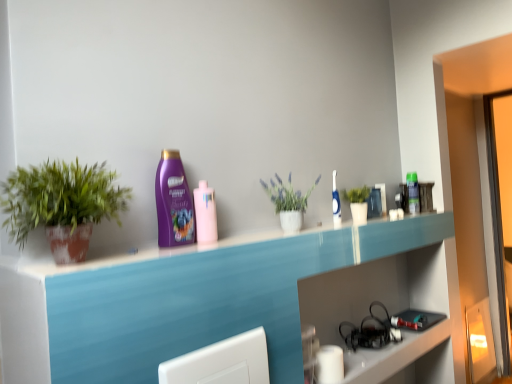
Question: In the image, is white matte vase at center, the second houseplant viewed from the left, positioned in front of or behind green matte plant at left, arranged as the 3th houseplant when viewed from the right?

Choices:
 (A) front
 (B) behind

Answer: (B)

Question: Considering the positions of white matte vase at center, positioned as the 2th houseplant in right-to-left order, and green matte plant at left, arranged as the 3th houseplant when viewed from the right, in the image, is white matte vase at center, positioned as the 2th houseplant in right-to-left order, wider or thinner than green matte plant at left, arranged as the 3th houseplant when viewed from the right,?

Choices:
 (A) thin
 (B) wide

Answer: (A)

Question: Based on their relative distances, which object is farther from the green matte plant at upper right, marked as the 3th houseplant in a front-to-back arrangement?

Choices:
 (A) green matte plant at left, acting as the first houseplant starting from the front
 (B) white matte vase at center, the 2th houseplant viewed from the front
 (C) pink glossy mouthwash at center, positioned as the first mouthwash in front-to-back order
 (D) white glossy toothbrush at upper center, which is the second mouthwash in back-to-front order
 (E) purple glossy shampoo at center

Answer: (A)

Question: Which object is positioned closest to the white glossy toothbrush at upper center, positioned as the 2th mouthwash in left-to-right order?

Choices:
 (A) pink glossy mouthwash at center, positioned as the first mouthwash in front-to-back order
 (B) green matte plant at upper right, marked as the 3th houseplant in a front-to-back arrangement
 (C) green matte plant at left, acting as the first houseplant starting from the front
 (D) white matte vase at center, the 2th houseplant viewed from the front
 (E) green plastic bottle at upper right, which is the 1th mouthwash in back-to-front order

Answer: (B)